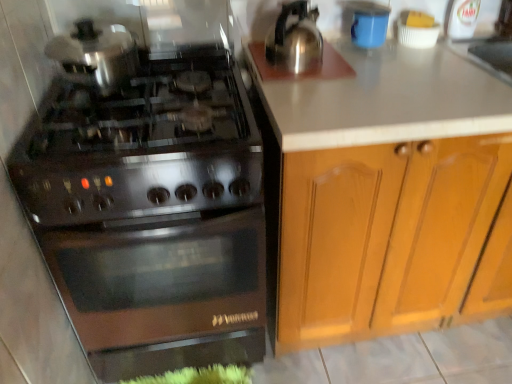
At what (x,y) coordinates should I click in order to perform the action: click on blue matte cup at upper right. Please return your answer as a coordinate pair (x, y). The image size is (512, 384). Looking at the image, I should click on (368, 23).

Is wooden cabinet at right turned away from blue matte cup at upper right?

No, wooden cabinet at right's orientation is not away from blue matte cup at upper right.

Looking at this image, is wooden cabinet at right placed right next to blue matte cup at upper right?

wooden cabinet at right is not next to blue matte cup at upper right, and they're not touching.

Considering the relative positions of wooden cabinet at right and blue matte cup at upper right in the image provided, is wooden cabinet at right in front of blue matte cup at upper right?

Yes.

Is wooden cabinet at right inside the boundaries of blue matte cup at upper right, or outside?

wooden cabinet at right lies outside blue matte cup at upper right.

Does blue matte cup at upper right have a larger size compared to wooden cabinet at right?

Incorrect, blue matte cup at upper right is not larger than wooden cabinet at right.

Based on the photo, between blue matte cup at upper right and wooden cabinet at right, which one appears on the left side from the viewer's perspective?

Positioned to the left is blue matte cup at upper right.

Would you say blue matte cup at upper right contains wooden cabinet at right?

Actually, wooden cabinet at right is outside blue matte cup at upper right.

Are blue matte cup at upper right and wooden cabinet at right beside each other?

blue matte cup at upper right and wooden cabinet at right are clearly separated.

Find the location of a particular element. This screenshot has height=384, width=512. appliance behind the stainless steel gas stove at left is located at coordinates (368, 23).

Does blue matte cup at upper right have a larger size compared to stainless steel gas stove at left?

No.

Which object is positioned more to the left, blue matte cup at upper right or stainless steel gas stove at left?

stainless steel gas stove at left.

From a real-world perspective, between stainless steel gas stove at left and wooden cabinet at right, who is vertically higher?

From a 3D spatial view, stainless steel gas stove at left is above.

Looking at this image, considering the relative sizes of stainless steel gas stove at left and wooden cabinet at right in the image provided, is stainless steel gas stove at left thinner than wooden cabinet at right?

No, stainless steel gas stove at left is not thinner than wooden cabinet at right.

Find the location of a particular element. This screenshot has height=384, width=512. gas stove located in front of the wooden cabinet at right is located at coordinates (152, 213).

Between wooden cabinet at right and stainless steel gas stove at left, which one has less height?

With less height is stainless steel gas stove at left.

Consider the image. Considering the sizes of objects wooden cabinet at right and stainless steel gas stove at left in the image provided, who is bigger, wooden cabinet at right or stainless steel gas stove at left?

wooden cabinet at right.

Does point (478, 251) come in front of point (109, 341)?

No, it is not.

From the image's perspective, who appears lower, wooden cabinet at right or stainless steel gas stove at left?

From the image's view, stainless steel gas stove at left is below.

Is stainless steel gas stove at left turned away from blue matte cup at upper right?

That's not correct — stainless steel gas stove at left is not looking away from blue matte cup at upper right.

Is blue matte cup at upper right inside stainless steel gas stove at left?

No, blue matte cup at upper right is not surrounded by stainless steel gas stove at left.

Does stainless steel gas stove at left lie behind blue matte cup at upper right?

No, stainless steel gas stove at left is closer to the viewer.

Looking at the image, does stainless steel gas stove at left seem bigger or smaller compared to blue matte cup at upper right?

In the image, stainless steel gas stove at left appears to be larger than blue matte cup at upper right.

Locate an element on the screen. cabinetry located on the right of blue matte cup at upper right is located at coordinates (383, 235).

Identify the location of cabinetry lying below the blue matte cup at upper right (from the image's perspective). (383, 235).

When comparing their distances from wooden cabinet at right, does blue matte cup at upper right or stainless steel gas stove at left seem further?

blue matte cup at upper right lies further to wooden cabinet at right than the other object.

Considering their positions, is wooden cabinet at right positioned closer to blue matte cup at upper right than stainless steel gas stove at left?

wooden cabinet at right.

Estimate the real-world distances between objects in this image. Which object is closer to wooden cabinet at right, stainless steel gas stove at left or blue matte cup at upper right?

stainless steel gas stove at left is positioned closer to the anchor wooden cabinet at right.

Which object lies further to the anchor point stainless steel gas stove at left, wooden cabinet at right or blue matte cup at upper right?

Among the two, blue matte cup at upper right is located further to stainless steel gas stove at left.

When comparing their distances from blue matte cup at upper right, does stainless steel gas stove at left or wooden cabinet at right seem further?

Based on the image, stainless steel gas stove at left appears to be further to blue matte cup at upper right.

Estimate the real-world distances between objects in this image. Which object is closer to stainless steel gas stove at left, blue matte cup at upper right or wooden cabinet at right?

wooden cabinet at right.

Image resolution: width=512 pixels, height=384 pixels. What are the coordinates of `appliance between stainless steel gas stove at left and wooden cabinet at right in the horizontal direction` in the screenshot? It's located at (368, 23).